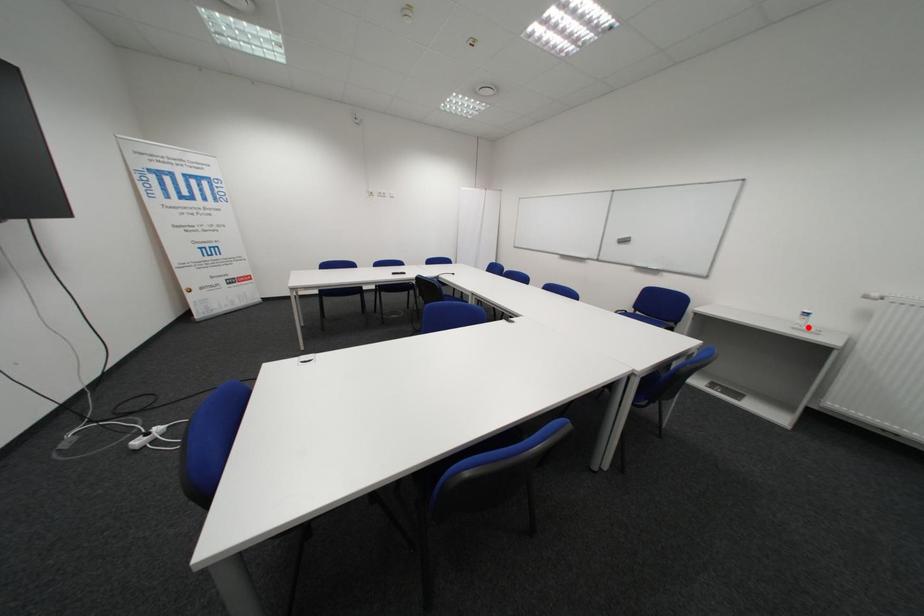
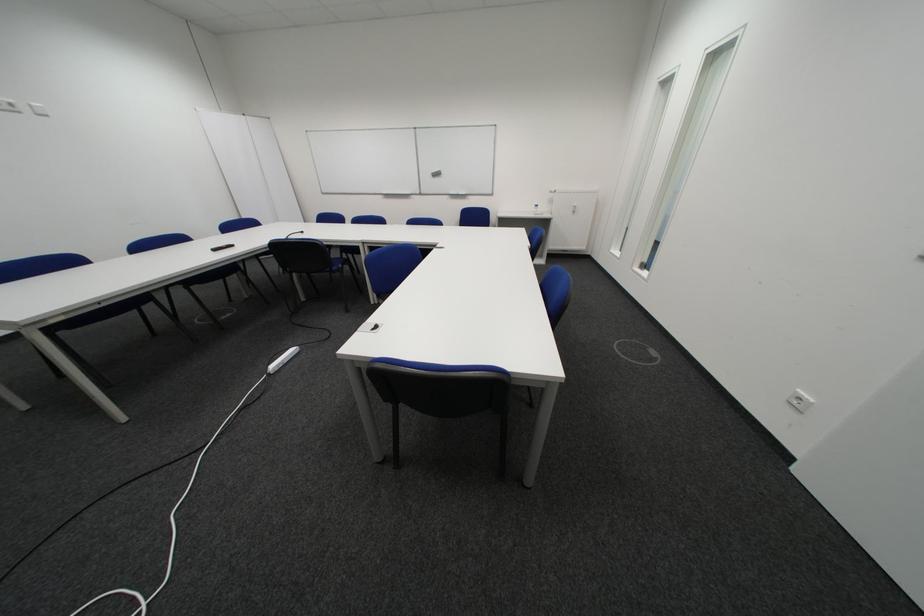
Locate, in the second image, the point that corresponds to the highlighted location in the first image.

(548, 215)